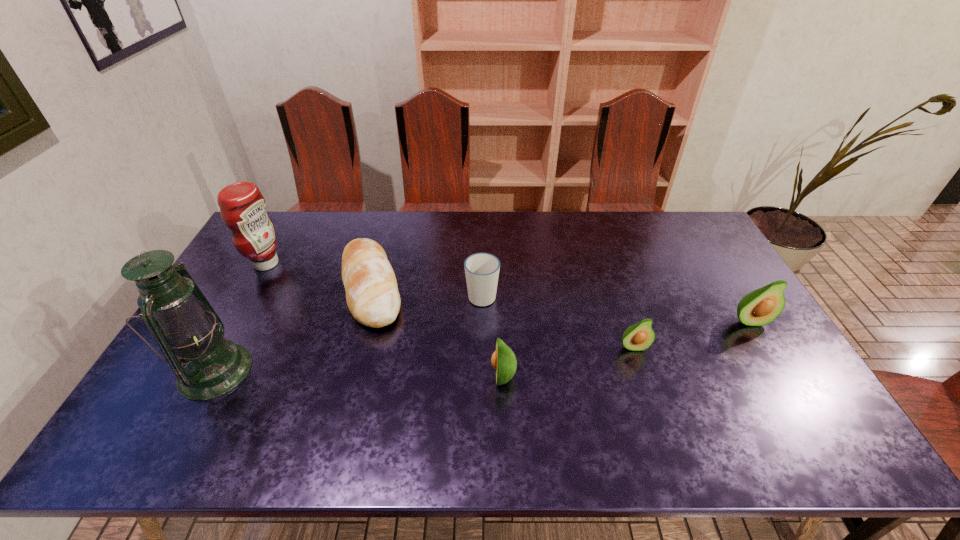
You are a GUI agent. You are given a task and a screenshot of the screen. Output one action in this format:
    pyautogui.click(x=<x>, y=<y>)
    Task: Click on the object located at the far edge
    The image size is (960, 540).
    Given the screenshot: What is the action you would take?
    pos(242,207)

Image resolution: width=960 pixels, height=540 pixels. Find the location of `avocado that is at the near edge`. avocado that is at the near edge is located at coordinates (503, 360).

Locate an element on the screen. The image size is (960, 540). oil lamp that is positioned at the near edge is located at coordinates (184, 324).

You are a GUI agent. You are given a task and a screenshot of the screen. Output one action in this format:
    pyautogui.click(x=<x>, y=<y>)
    Task: Click on the condiment positioned at the left edge
    The width and height of the screenshot is (960, 540).
    Given the screenshot: What is the action you would take?
    pyautogui.click(x=242, y=207)

This screenshot has width=960, height=540. What are the coordinates of `oil lamp that is at the left edge` in the screenshot? It's located at (184, 324).

Image resolution: width=960 pixels, height=540 pixels. Find the location of `object located at the right edge`. object located at the right edge is located at coordinates (760, 307).

The width and height of the screenshot is (960, 540). I want to click on object located in the far left corner section of the desktop, so click(242, 207).

Identify the location of object at the near left corner. This screenshot has height=540, width=960. point(184,324).

The width and height of the screenshot is (960, 540). In the image, there is a desktop. In order to click on vacant space at the far edge in this screenshot , I will do `click(566, 217)`.

In the image, there is a desktop. Where is `vacant region at the near edge`? vacant region at the near edge is located at coordinates (477, 389).